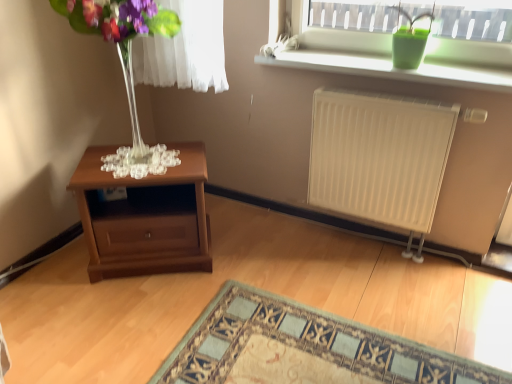
Locate an element on the screen. The image size is (512, 384). vacant area located to the right-hand side of mahogany wood nightstand at lower left is located at coordinates (247, 259).